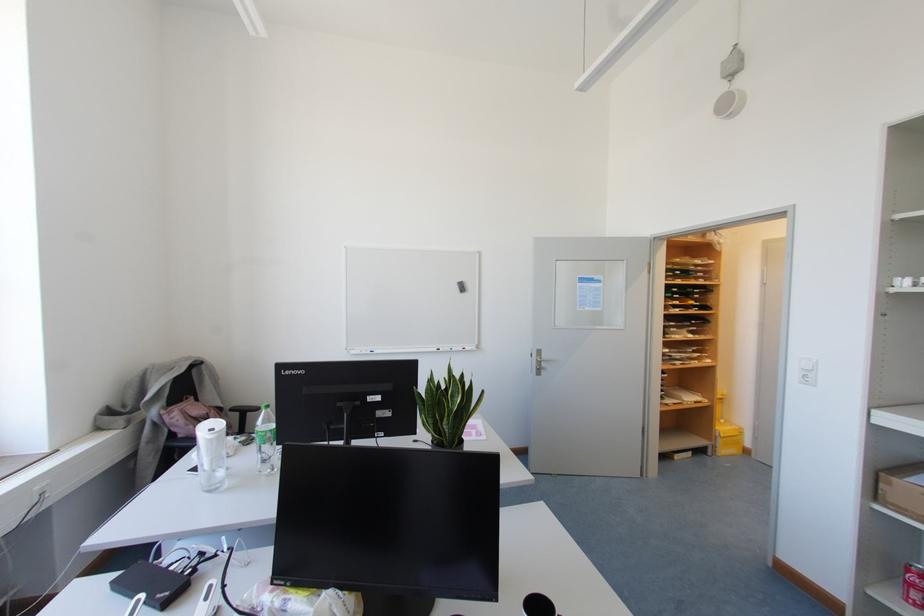
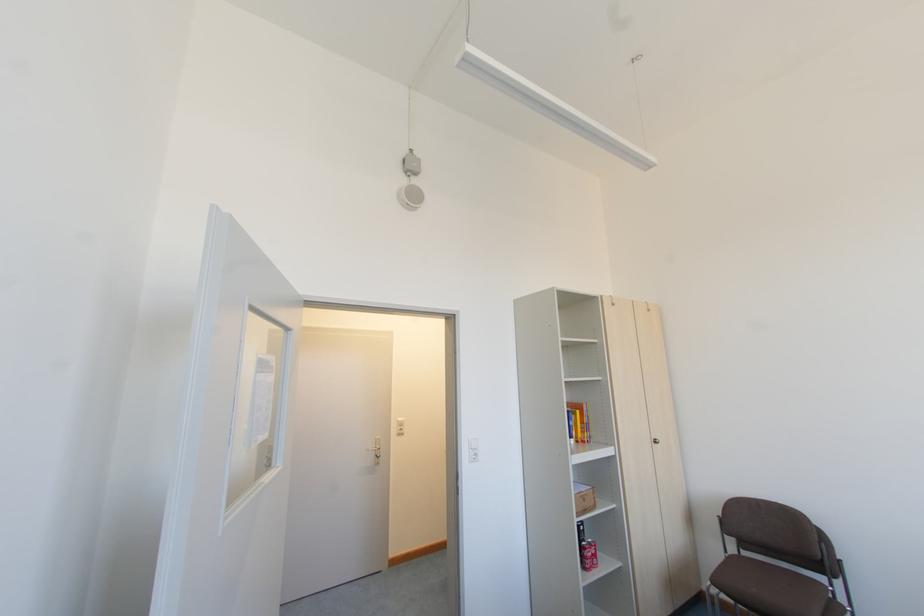
In the second image, find the point that corresponds to (804,374) in the first image.

(472, 453)